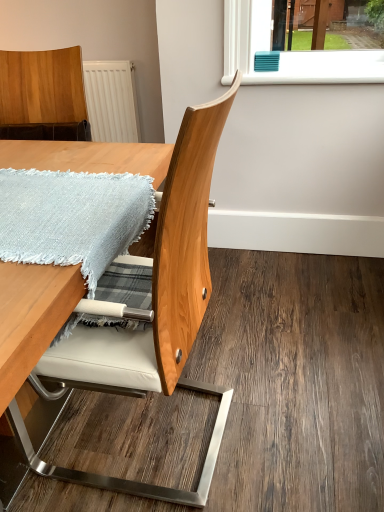
What are the coordinates of `wooden chair at lower right` in the screenshot? It's located at (296, 380).

Locate an element on the screen. The width and height of the screenshot is (384, 512). wooden table at center is located at coordinates [31, 322].

Consider the image. Are wooden table at center and wooden chair at lower right far apart?

No, wooden table at center is in close proximity to wooden chair at lower right.

From the image's perspective, between wooden table at center and wooden chair at lower right, who is located below?

wooden chair at lower right, from the image's perspective.

This screenshot has height=512, width=384. What are the coordinates of `table in front of the wooden chair at lower right` in the screenshot? It's located at (31, 322).

From a real-world perspective, which is physically below, wooden table at center or wooden chair at lower right?

In real-world perspective, wooden chair at lower right is lower.

In the scene shown: Considering the positions of objects white plastic window sill at upper center and light blue woven blanket at lower left in the image provided, who is more to the right, white plastic window sill at upper center or light blue woven blanket at lower left?

white plastic window sill at upper center is more to the right.

From the picture: Who is smaller, white plastic window sill at upper center or light blue woven blanket at lower left?

Smaller between the two is light blue woven blanket at lower left.

Considering the sizes of white plastic window sill at upper center and light blue woven blanket at lower left in the image, is white plastic window sill at upper center taller or shorter than light blue woven blanket at lower left?

In the image, white plastic window sill at upper center appears to be taller than light blue woven blanket at lower left.

I want to click on window sill that is above the light blue woven blanket at lower left (from a real-world perspective), so click(322, 68).

Can you confirm if wooden chair at center is smaller than wooden table at center?

Indeed, wooden chair at center has a smaller size compared to wooden table at center.

From the picture: Which is more to the left, wooden chair at center or wooden table at center?

wooden table at center is more to the left.

Between wooden chair at center and wooden table at center, which one is positioned behind?

Positioned behind is wooden chair at center.

Does point (201, 294) appear closer or farther from the camera than point (57, 308)?

Point (201, 294) appears to be farther away from the viewer than point (57, 308).

From a real-world perspective, which is physically above, wooden table at center or light blue woven blanket at lower left?

From a 3D spatial view, light blue woven blanket at lower left is above.

Is wooden table at center beside light blue woven blanket at lower left?

wooden table at center and light blue woven blanket at lower left are not in contact.

Where is `table below the light blue woven blanket at lower left (from the image's perspective)`? The height and width of the screenshot is (512, 384). table below the light blue woven blanket at lower left (from the image's perspective) is located at coordinates (31, 322).

Is wooden table at center not inside light blue woven blanket at lower left?

Yes, wooden table at center is located beyond the bounds of light blue woven blanket at lower left.

Considering the relative sizes of wooden chair at center and wooden chair at lower right in the image provided, is wooden chair at center smaller than wooden chair at lower right?

Incorrect, wooden chair at center is not smaller in size than wooden chair at lower right.

Considering the sizes of objects wooden chair at center and wooden chair at lower right in the image provided, who is wider, wooden chair at center or wooden chair at lower right?

wooden chair at lower right is wider.

How distant is white plastic window sill at upper center from wooden table at center?

A distance of 32.52 inches exists between white plastic window sill at upper center and wooden table at center.

Consider the image. Who is shorter, white plastic window sill at upper center or wooden table at center?

Standing shorter between the two is white plastic window sill at upper center.

Is white plastic window sill at upper center smaller than wooden table at center?

Indeed, white plastic window sill at upper center has a smaller size compared to wooden table at center.

Which object is further away from the camera taking this photo, white plastic window sill at upper center or wooden table at center?

white plastic window sill at upper center is behind.

Does light blue woven blanket at lower left have a lesser width compared to wooden table at center?

Correct, the width of light blue woven blanket at lower left is less than that of wooden table at center.

From the image's perspective, between light blue woven blanket at lower left and wooden table at center, who is located below?

wooden table at center appears lower in the image.

This screenshot has width=384, height=512. I want to click on blanket to the right of wooden table at center, so [72, 218].

Considering the sizes of light blue woven blanket at lower left and wooden table at center in the image, is light blue woven blanket at lower left bigger or smaller than wooden table at center?

Clearly, light blue woven blanket at lower left is smaller in size than wooden table at center.

Locate an element on the screen. The width and height of the screenshot is (384, 512). table in front of the wooden chair at lower right is located at coordinates (31, 322).

Where is `window sill located above the light blue woven blanket at lower left (from the image's perspective)`? window sill located above the light blue woven blanket at lower left (from the image's perspective) is located at coordinates (322, 68).

Looking at this image, estimate the real-world distances between objects in this image. Which object is closer to light blue woven blanket at lower left, wooden chair at lower right or wooden table at center?

Based on the image, wooden table at center appears to be nearer to light blue woven blanket at lower left.

Considering their positions, is wooden chair at center positioned further to wooden chair at lower right than white plastic window sill at upper center?

white plastic window sill at upper center.

Looking at the image, which one is located closer to white plastic window sill at upper center, wooden chair at center or wooden table at center?

wooden table at center is closer to white plastic window sill at upper center.

When comparing their distances from wooden chair at center, does light blue woven blanket at lower left or wooden chair at lower right seem closer?

Among the two, light blue woven blanket at lower left is located nearer to wooden chair at center.

When comparing their distances from wooden chair at lower right, does white plastic window sill at upper center or light blue woven blanket at lower left seem further?

white plastic window sill at upper center.

When comparing their distances from wooden table at center, does white plastic window sill at upper center or wooden chair at center seem closer?

wooden chair at center is positioned closer to the anchor wooden table at center.

Looking at the image, which one is located closer to wooden table at center, wooden chair at lower right or white plastic window sill at upper center?

Based on the image, wooden chair at lower right appears to be nearer to wooden table at center.

When comparing their distances from wooden chair at lower right, does white plastic window sill at upper center or wooden table at center seem further?

The object further to wooden chair at lower right is white plastic window sill at upper center.

The image size is (384, 512). In order to click on blanket between wooden table at center and wooden chair at center in this screenshot , I will do `click(72, 218)`.

You are a GUI agent. You are given a task and a screenshot of the screen. Output one action in this format:
    pyautogui.click(x=<x>, y=<y>)
    Task: Click on the chair situated between wooden table at center and wooden chair at lower right from left to right
    The image size is (384, 512).
    Given the screenshot: What is the action you would take?
    (154, 315)

At what (x,y) coordinates should I click in order to perform the action: click on blanket between wooden chair at center and white plastic window sill at upper center in the front-back direction. Please return your answer as a coordinate pair (x, y). Image resolution: width=384 pixels, height=512 pixels. Looking at the image, I should click on (72, 218).

Where is `blanket between white plastic window sill at upper center and wooden chair at lower right from top to bottom`? Image resolution: width=384 pixels, height=512 pixels. blanket between white plastic window sill at upper center and wooden chair at lower right from top to bottom is located at coordinates (72, 218).